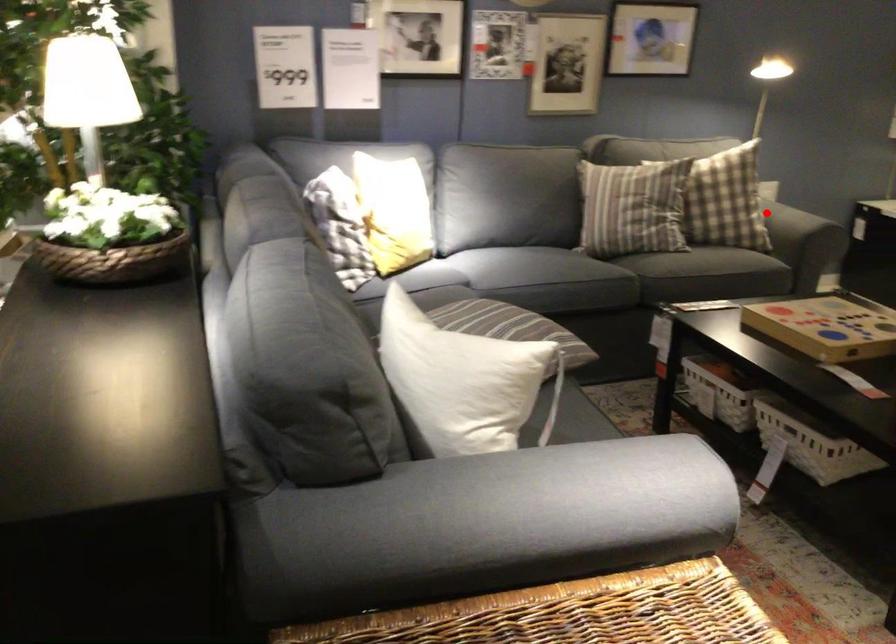
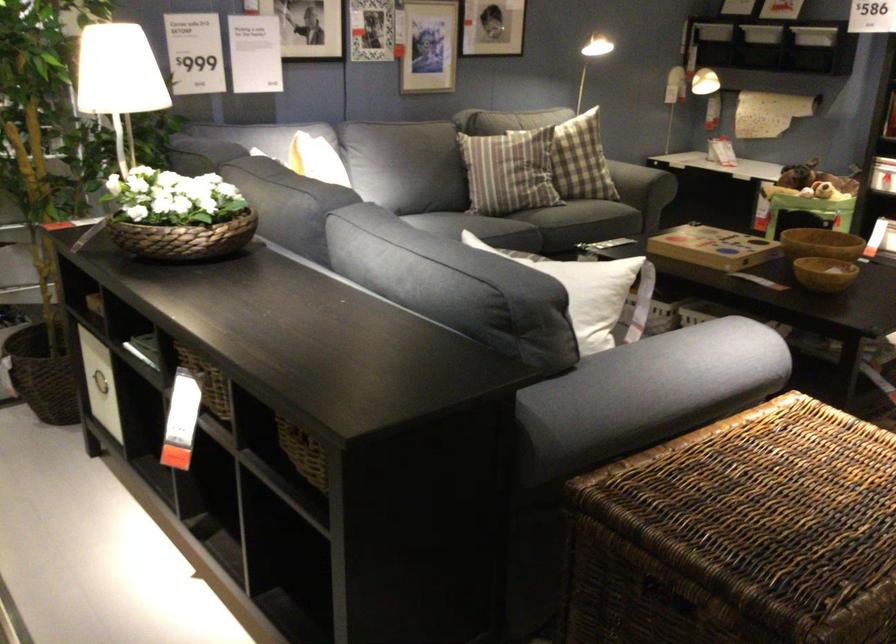
Locate, in the second image, the point that corresponds to the highlighted location in the first image.

(633, 180)